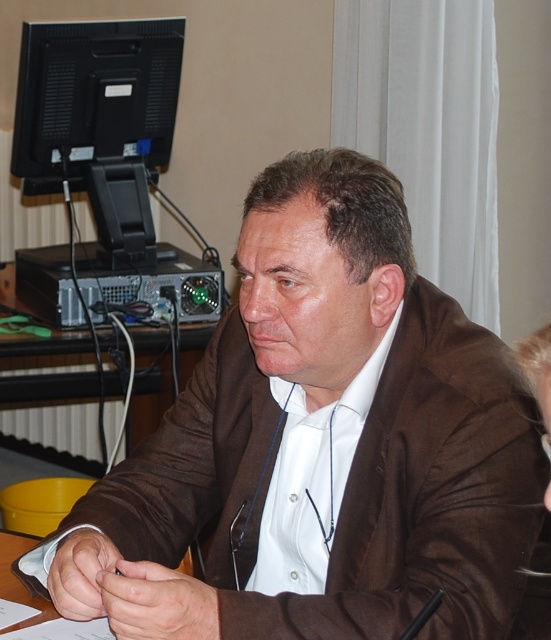
Question: Is brown fabric jacket at center above black matte monitor at upper left?

Choices:
 (A) no
 (B) yes

Answer: (A)

Question: From the image, what is the correct spatial relationship of brown fabric jacket at center in relation to black matte monitor at upper left?

Choices:
 (A) below
 (B) above

Answer: (A)

Question: Does brown fabric jacket at center appear under black matte monitor at upper left?

Choices:
 (A) no
 (B) yes

Answer: (B)

Question: Which of the following is the closest to the observer?

Choices:
 (A) (424, 368)
 (B) (58, 38)

Answer: (A)

Question: Which point is closer to the camera?

Choices:
 (A) brown fabric jacket at center
 (B) black matte monitor at upper left

Answer: (A)

Question: Which of the following is the farthest from the observer?

Choices:
 (A) (252, 392)
 (B) (33, 189)

Answer: (B)